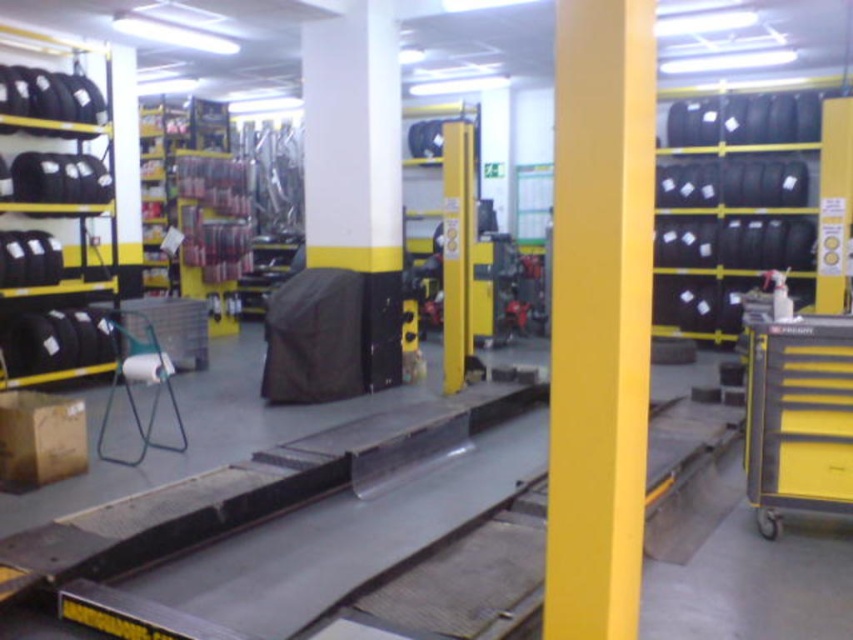
Consider the image. Which is above, yellow smooth pillar at center or black rubber tires at left?

Positioned higher is black rubber tires at left.

Is point (628, 596) behind point (4, 196)?

No, it is not.

The width and height of the screenshot is (853, 640). I want to click on yellow smooth pillar at center, so click(x=599, y=316).

Does yellow smooth pillar at center have a lesser height compared to black rubber tire at upper left?

In fact, yellow smooth pillar at center may be taller than black rubber tire at upper left.

Is yellow smooth pillar at center wider than black rubber tire at upper left?

Incorrect, yellow smooth pillar at center's width does not surpass black rubber tire at upper left's.

What do you see at coordinates (599, 316) in the screenshot?
I see `yellow smooth pillar at center` at bounding box center [599, 316].

This screenshot has width=853, height=640. Identify the location of yellow smooth pillar at center. (599, 316).

Describe the element at coordinates (357, 168) in the screenshot. The height and width of the screenshot is (640, 853). I see `black matte pillar at center` at that location.

Between point (363, 8) and point (755, 508), which one is positioned behind?

Positioned behind is point (363, 8).

Where is `black matte pillar at center`? The width and height of the screenshot is (853, 640). black matte pillar at center is located at coordinates (357, 168).